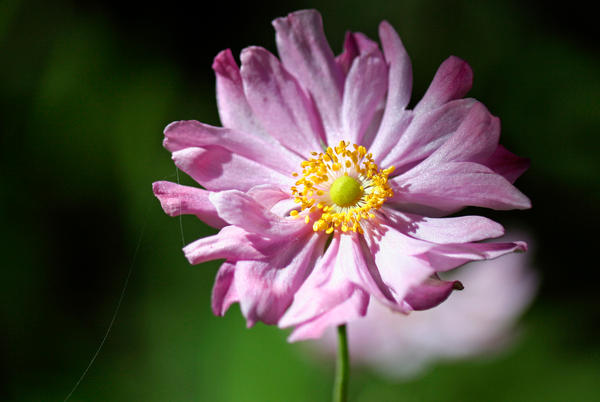
This screenshot has height=402, width=600. Identify the location of flower center. (342, 185).